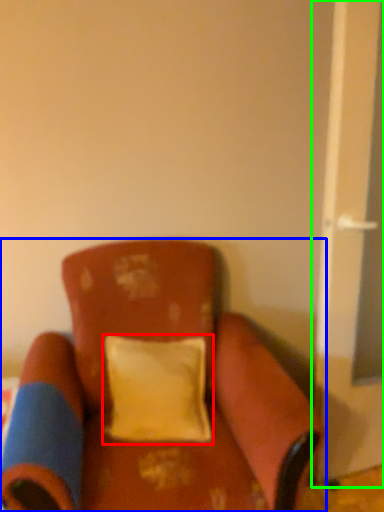
Question: Which object is the farthest from pillow (highlighted by a red box)? Choose among these: chair (highlighted by a blue box) or screen door (highlighted by a green box).

Choices:
 (A) chair
 (B) screen door

Answer: (B)